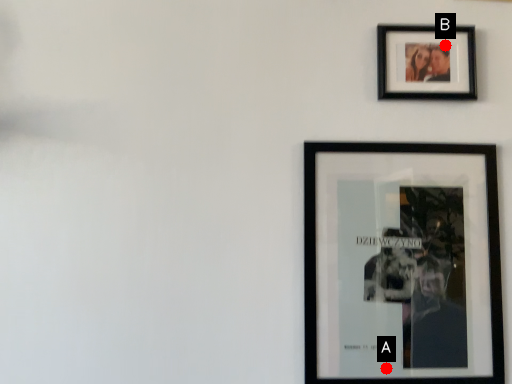
Question: Two points are circled on the image, labeled by A and B beside each circle. Among these points, which one is farthest from the camera?

Choices:
 (A) A is further
 (B) B is further

Answer: (B)